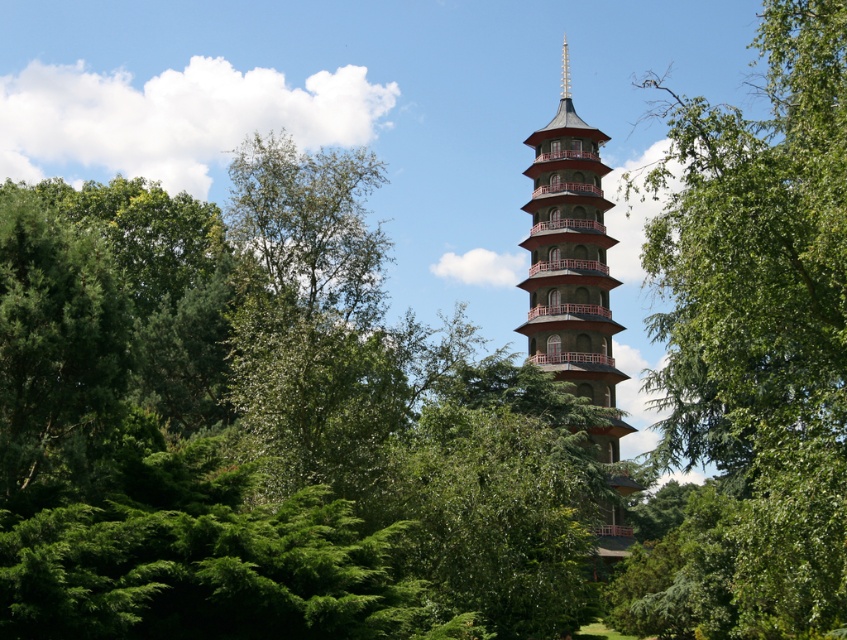
Question: Which point is farther from the camera taking this photo?

Choices:
 (A) (569, 92)
 (B) (558, 113)

Answer: (A)

Question: Among these points, which one is farthest from the camera?

Choices:
 (A) (715, 531)
 (B) (580, 241)

Answer: (B)

Question: Can you confirm if green leafy tree at center is positioned to the left of gold metallic spire at center?

Choices:
 (A) no
 (B) yes

Answer: (A)

Question: Where is green leafy tree at center located in relation to gold metallic spire at center in the image?

Choices:
 (A) left
 (B) right

Answer: (B)

Question: Which point is farther to the camera?

Choices:
 (A) (738, 230)
 (B) (573, 214)

Answer: (B)

Question: Is green leafy tree at center above gold metallic spire at center?

Choices:
 (A) no
 (B) yes

Answer: (A)